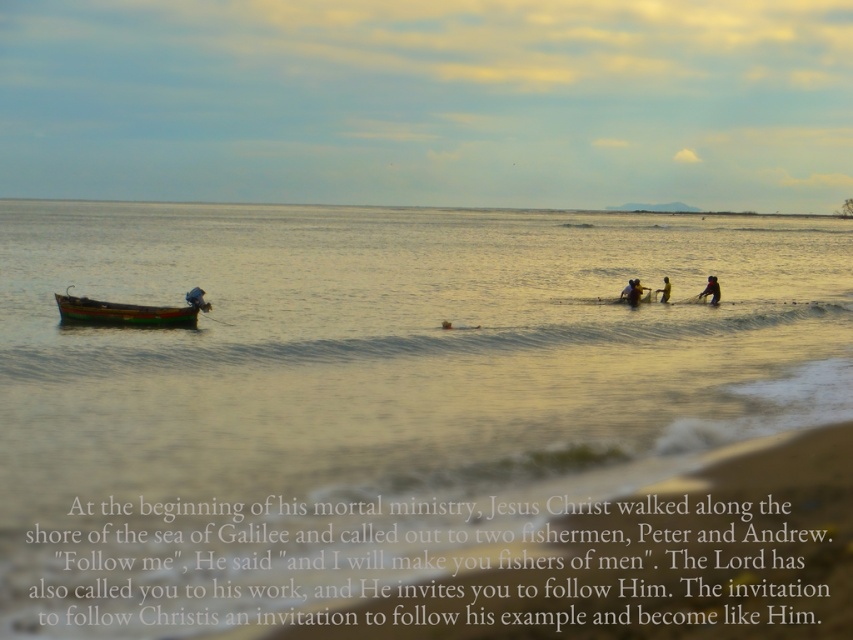
Does smooth golden water at center have a lesser width compared to wooden boat at left?

No, smooth golden water at center is not thinner than wooden boat at left.

Who is more distant from viewer, [53,320] or [79,321]?

The point [53,320] is behind.

Where is `smooth golden water at center`? The width and height of the screenshot is (853, 640). smooth golden water at center is located at coordinates (x=368, y=388).

Based on the photo, which is below, dark blue fabric at lower right or yellow fabric at center?

dark blue fabric at lower right is lower down.

Between dark blue fabric at lower right and yellow fabric at center, which one is positioned higher?

Positioned higher is yellow fabric at center.

Between point (706, 291) and point (665, 278), which one is positioned behind?

The point (665, 278) is behind.

At what (x,y) coordinates should I click in order to perform the action: click on dark blue fabric at lower right. Please return your answer as a coordinate pair (x, y). Looking at the image, I should click on click(x=711, y=289).

Locate an element on the screen. This screenshot has height=640, width=853. smooth golden water at center is located at coordinates (368, 388).

In the scene shown: Can you confirm if smooth golden water at center is bigger than yellow fabric at center?

Indeed, smooth golden water at center has a larger size compared to yellow fabric at center.

Where is `smooth golden water at center`? Image resolution: width=853 pixels, height=640 pixels. smooth golden water at center is located at coordinates (368, 388).